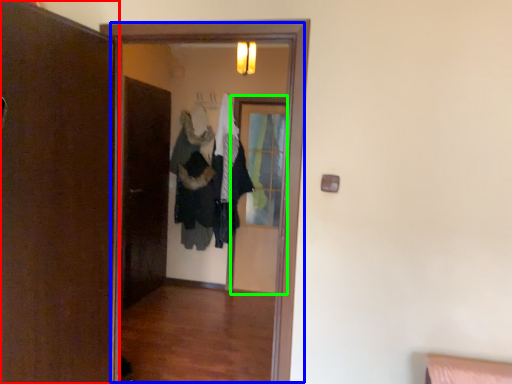
Question: Which is nearer to the door (highlighted by a red box)? screen door (highlighted by a blue box) or screen door (highlighted by a green box).

Choices:
 (A) screen door
 (B) screen door

Answer: (A)